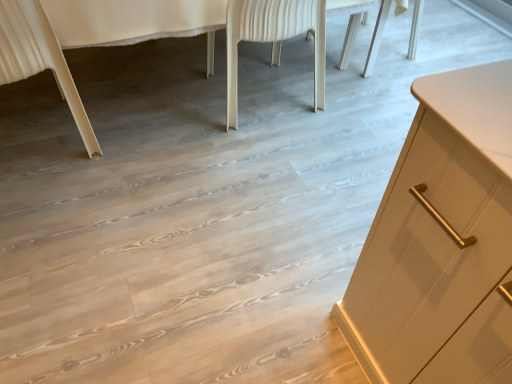
Locate an element on the screen. free point below white glossy cabinet at right (from a real-world perspective) is located at coordinates (152, 77).